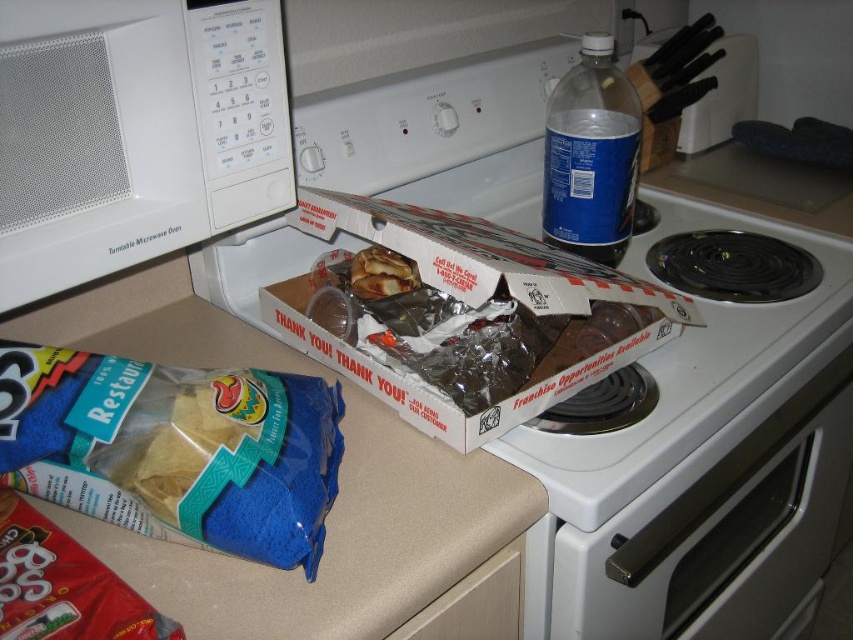
Question: Is white cardboard box at center above blue plastic bottle at upper right?

Choices:
 (A) no
 (B) yes

Answer: (A)

Question: In this image, where is white glossy oven at lower right located relative to wooden knife block at upper right?

Choices:
 (A) below
 (B) above

Answer: (A)

Question: Can you confirm if white cardboard box at center is positioned to the left of blue plastic bottle at upper right?

Choices:
 (A) yes
 (B) no

Answer: (A)

Question: Which point appears closest to the camera in this image?

Choices:
 (A) (33, 266)
 (B) (383, 282)
 (C) (566, 465)

Answer: (A)

Question: Which object appears farthest from the camera in this image?

Choices:
 (A) white glossy oven at lower right
 (B) white ceramic gas stove at upper center
 (C) white matte microwave oven at left
 (D) white cardboard box at center

Answer: (D)

Question: Which of the following is the closest to the observer?

Choices:
 (A) (132, 177)
 (B) (340, 221)
 (C) (335, 428)

Answer: (A)